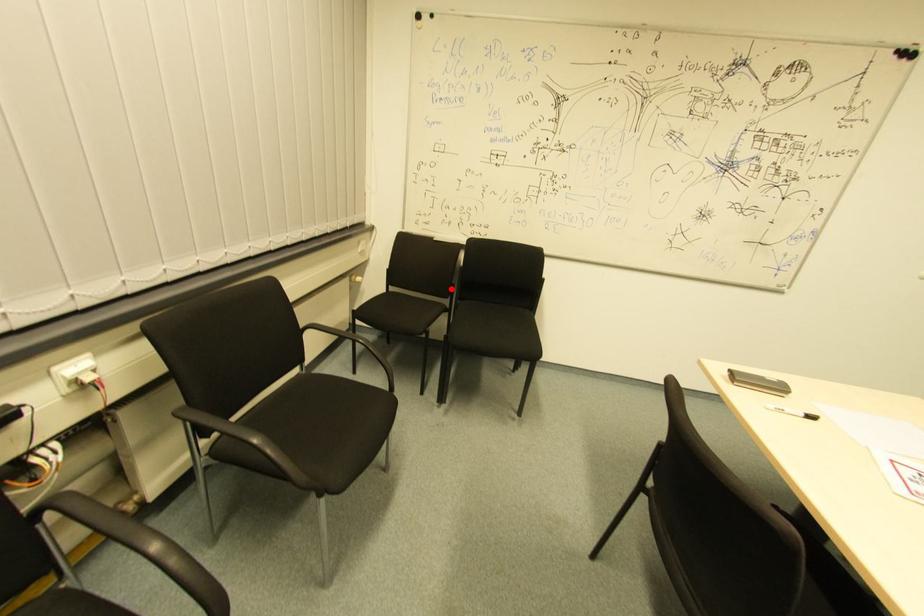
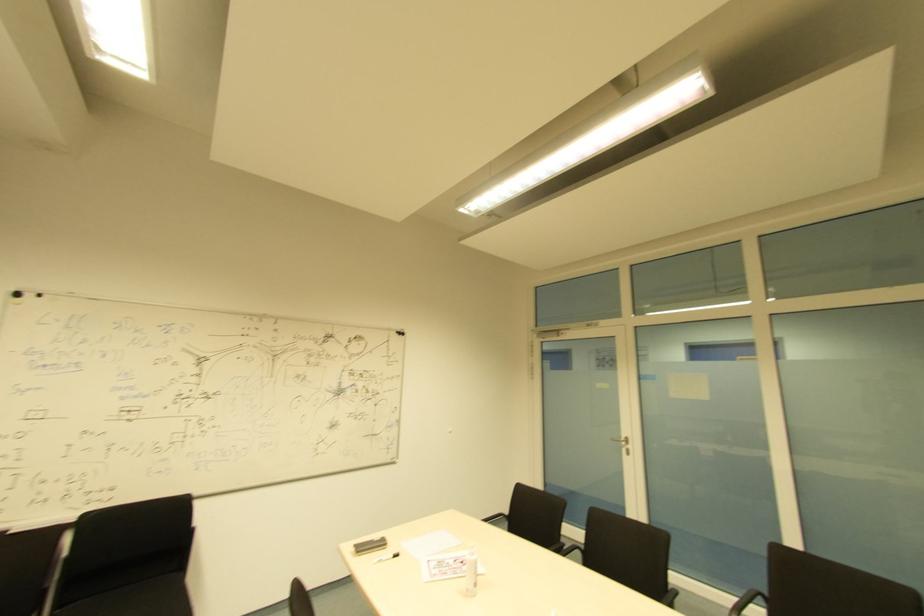
Question: A red point is marked in image1. In image2, is the corresponding 3D point closer to the camera or farther? Reply with the corresponding letter.

Choices:
 (A) The corresponding 3D point is closer.
 (B) The corresponding 3D point is farther.

Answer: (A)